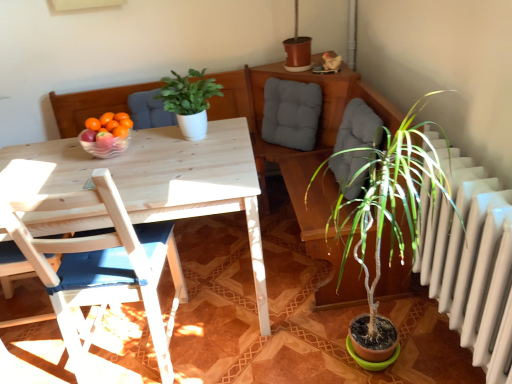
You are a GUI agent. You are given a task and a screenshot of the screen. Output one action in this format:
    pyautogui.click(x=<x>, y=<y>)
    Task: Click on the gray fabric cushion at upper center
    The width and height of the screenshot is (512, 384).
    Given the screenshot: What is the action you would take?
    (x=284, y=123)

Measure the distance between wooden chair with blue cushion at left and camera.

wooden chair with blue cushion at left and camera are 1.28 meters apart from each other.

Describe the element at coordinates (105, 148) in the screenshot. I see `transparent glass bowl at table` at that location.

You are a GUI agent. You are given a task and a screenshot of the screen. Output one action in this format:
    pyautogui.click(x=<x>, y=<y>)
    Task: Click on the gray fabric cushion at upper center
    The height and width of the screenshot is (384, 512).
    Given the screenshot: What is the action you would take?
    pyautogui.click(x=284, y=123)

Does gray fabric cushion at upper center turn towards wooden chair with blue cushion at left?

Yes, gray fabric cushion at upper center is oriented towards wooden chair with blue cushion at left.

From the image's perspective, which one is positioned lower, gray fabric cushion at upper center or wooden chair with blue cushion at left?

wooden chair with blue cushion at left.

Considering the relative sizes of gray fabric cushion at upper center and wooden chair with blue cushion at left in the image provided, is gray fabric cushion at upper center thinner than wooden chair with blue cushion at left?

Indeed, gray fabric cushion at upper center has a lesser width compared to wooden chair with blue cushion at left.

Does gray fabric cushion at upper center contain wooden chair with blue cushion at left?

No.

Consider the image. Considering their positions, is wooden chair with blue cushion at left located in front of or behind transparent glass bowl at table?

wooden chair with blue cushion at left is positioned closer to the viewer than transparent glass bowl at table.

Consider the image. In terms of size, does wooden chair with blue cushion at left appear bigger or smaller than transparent glass bowl at table?

wooden chair with blue cushion at left is bigger than transparent glass bowl at table.

Is wooden chair with blue cushion at left positioned with its back to transparent glass bowl at table?

No.

Considering the positions of objects wooden chair with blue cushion at left and transparent glass bowl at table in the image provided, who is more to the right, wooden chair with blue cushion at left or transparent glass bowl at table?

wooden chair with blue cushion at left is more to the right.

Is transparent glass bowl at table located outside gray fabric cushion at upper center?

Yes, transparent glass bowl at table is not within gray fabric cushion at upper center.

Considering the relative positions of transparent glass bowl at table and gray fabric cushion at upper center in the image provided, is transparent glass bowl at table behind gray fabric cushion at upper center?

No.

Is point (82, 134) positioned in front of point (313, 99)?

Yes.

Is gray fabric cushion at upper center at the back of transparent glass bowl at table?

transparent glass bowl at table does not have its back to gray fabric cushion at upper center.

Is the position of wooden chair with blue cushion at left less distant than that of gray fabric cushion at upper center?

Yes, the depth of wooden chair with blue cushion at left is less than that of gray fabric cushion at upper center.

Is wooden chair with blue cushion at left with gray fabric cushion at upper center?

No, wooden chair with blue cushion at left is not touching gray fabric cushion at upper center.

Looking at this image, is wooden chair with blue cushion at left facing away from gray fabric cushion at upper center?

No, wooden chair with blue cushion at left is not facing away from gray fabric cushion at upper center.

Does point (196, 75) lie behind point (51, 198)?

Yes, point (196, 75) is behind point (51, 198).

Is green matte plant at center bigger or smaller than wooden chair with blue cushion at left?

green matte plant at center is smaller than wooden chair with blue cushion at left.

Considering the positions of objects green matte plant at center and wooden chair with blue cushion at left in the image provided, who is more to the left, green matte plant at center or wooden chair with blue cushion at left?

Positioned to the left is wooden chair with blue cushion at left.

From the image's perspective, would you say green matte plant at center is positioned over wooden chair with blue cushion at left?

Indeed, from the image's perspective, green matte plant at center is shown above wooden chair with blue cushion at left.

Which of these two, wooden chair with blue cushion at left or green matte plant at center, is thinner?

green matte plant at center is thinner.

Is point (106, 279) closer or farther from the camera than point (185, 106)?

Point (106, 279).

In the scene shown: Do you think wooden chair with blue cushion at left is within green matte plant at center, or outside of it?

wooden chair with blue cushion at left is not inside green matte plant at center, it's outside.

How much distance is there between wooden chair with blue cushion at left and green matte plant at center?

wooden chair with blue cushion at left and green matte plant at center are 25.59 inches apart.

Between transparent glass bowl at table and green matte plant at center, which one has smaller size?

Answer: transparent glass bowl at table is smaller.

From a real-world perspective, who is located lower, transparent glass bowl at table or green matte plant at center?

transparent glass bowl at table.

Considering the relative sizes of transparent glass bowl at table and green matte plant at center in the image provided, is transparent glass bowl at table wider than green matte plant at center?

No.

Is green matte plant at center surrounded by transparent glass bowl at table?

No, green matte plant at center is located outside of transparent glass bowl at table.

Locate an element on the screen. The image size is (512, 384). swivel chair on the right of wooden chair with blue cushion at left is located at coordinates (284, 123).

Identify the location of bowl behind the wooden chair with blue cushion at left. This screenshot has width=512, height=384. (105, 148).

Which object lies further to the anchor point green matte plant at center, gray fabric cushion at upper center or wooden chair with blue cushion at left?

Based on the image, wooden chair with blue cushion at left appears to be further to green matte plant at center.

From the image, which object appears to be nearer to gray fabric cushion at upper center, green matte plant at center or transparent glass bowl at table?

green matte plant at center is positioned closer to the anchor gray fabric cushion at upper center.

Considering their positions, is wooden chair with blue cushion at left positioned closer to gray fabric cushion at upper center than transparent glass bowl at table?

The object closer to gray fabric cushion at upper center is transparent glass bowl at table.

When comparing their distances from wooden chair with blue cushion at left, does green matte plant at center or gray fabric cushion at upper center seem further?

gray fabric cushion at upper center is positioned further to the anchor wooden chair with blue cushion at left.

Looking at the image, which one is located further to gray fabric cushion at upper center, wooden chair with blue cushion at left or green matte plant at center?

wooden chair with blue cushion at left lies further to gray fabric cushion at upper center than the other object.

Which object lies further to the anchor point transparent glass bowl at table, wooden chair with blue cushion at left or green matte plant at center?

Based on the image, wooden chair with blue cushion at left appears to be further to transparent glass bowl at table.

When comparing their distances from transparent glass bowl at table, does gray fabric cushion at upper center or green matte plant at center seem further?

gray fabric cushion at upper center is further to transparent glass bowl at table.

From the image, which object appears to be nearer to transparent glass bowl at table, wooden chair with blue cushion at left or gray fabric cushion at upper center?

The object closer to transparent glass bowl at table is wooden chair with blue cushion at left.

The width and height of the screenshot is (512, 384). In order to click on bowl between wooden chair with blue cushion at left and gray fabric cushion at upper center in the front-back direction in this screenshot , I will do `click(105, 148)`.

Locate an element on the screen. houseplant between transparent glass bowl at table and gray fabric cushion at upper center from left to right is located at coordinates (189, 101).

Locate an element on the screen. The height and width of the screenshot is (384, 512). bowl between green matte plant at center and wooden chair with blue cushion at left vertically is located at coordinates (105, 148).

Identify the location of houseplant positioned between wooden chair with blue cushion at left and gray fabric cushion at upper center from near to far. The width and height of the screenshot is (512, 384). (189, 101).